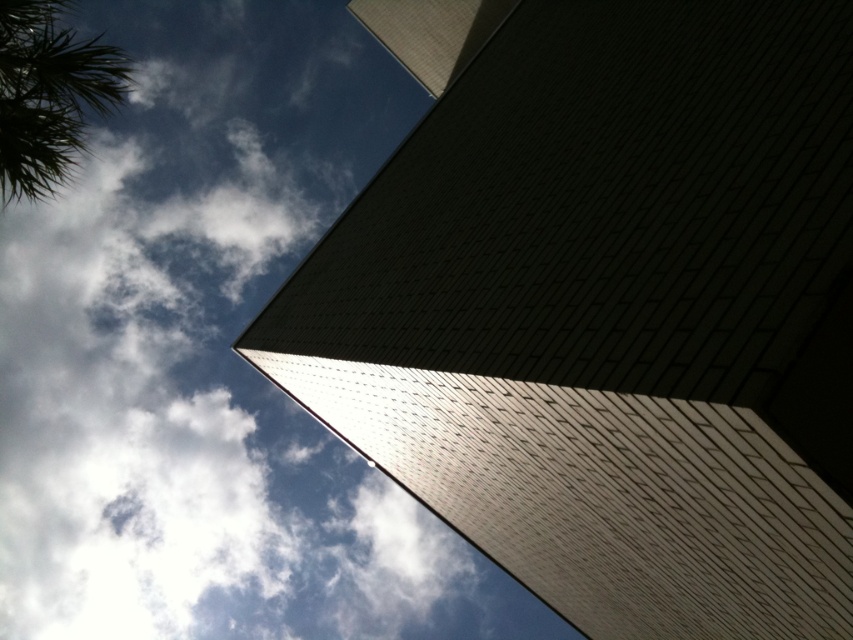
Question: In this image, where is white fluffy cloud at upper left located relative to green leafy palm tree at upper left?

Choices:
 (A) right
 (B) left

Answer: (B)

Question: Among these points, which one is farthest from the camera?

Choices:
 (A) (44, 131)
 (B) (242, 22)

Answer: (B)

Question: Which point is farther from the camera taking this photo?

Choices:
 (A) (9, 90)
 (B) (375, 147)

Answer: (B)

Question: Can you confirm if white fluffy cloud at upper left is wider than green leafy palm tree at upper left?

Choices:
 (A) no
 (B) yes

Answer: (B)

Question: Does white fluffy cloud at upper left have a larger size compared to green leafy palm tree at upper left?

Choices:
 (A) no
 (B) yes

Answer: (B)

Question: Which of the following is the closest to the observer?

Choices:
 (A) (38, 58)
 (B) (315, 451)

Answer: (A)